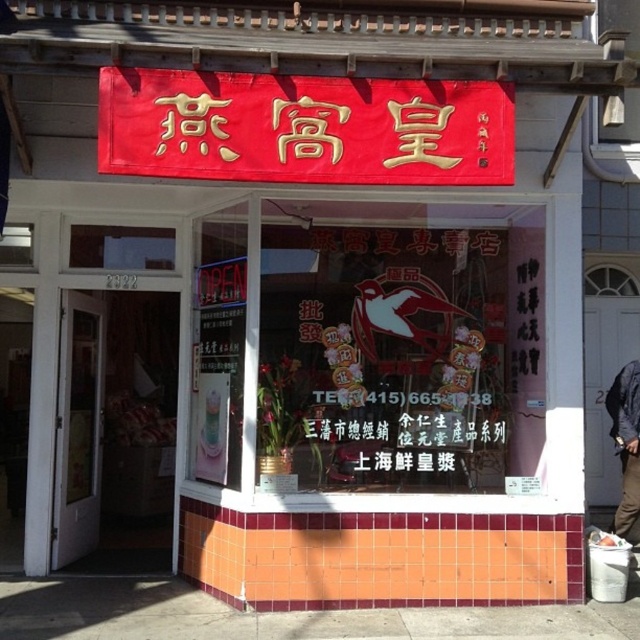
You are a delivery person standing outside the store. You need to hand over a package to the person wearing the dark blue jacket at lower right. Can you see their face through the transparent glass window at center?

The transparent glass window at center is positioned over the dark blue jacket at lower right, so yes, you can see their face through the transparent glass window at center.

You are a delivery person standing in front of the storefront. You need to hand over a package to the staff inside. Which object, the transparent glass window at center or the dark blue jacket at lower right, is closer to you?

The transparent glass window at center is closer to the viewer than the dark blue jacket at lower right, so you should hand over the package through the transparent glass window at center.

A delivery person needs to place a package on the ground in front of the transparent glass window at center. The delivery person is currently standing at the entrance of the building, which is 6.43 meters away from the window. Can they reach the window without moving closer?

The transparent glass window at center is 6.43 meters away from the entrance, so the delivery person cannot reach it without moving closer.